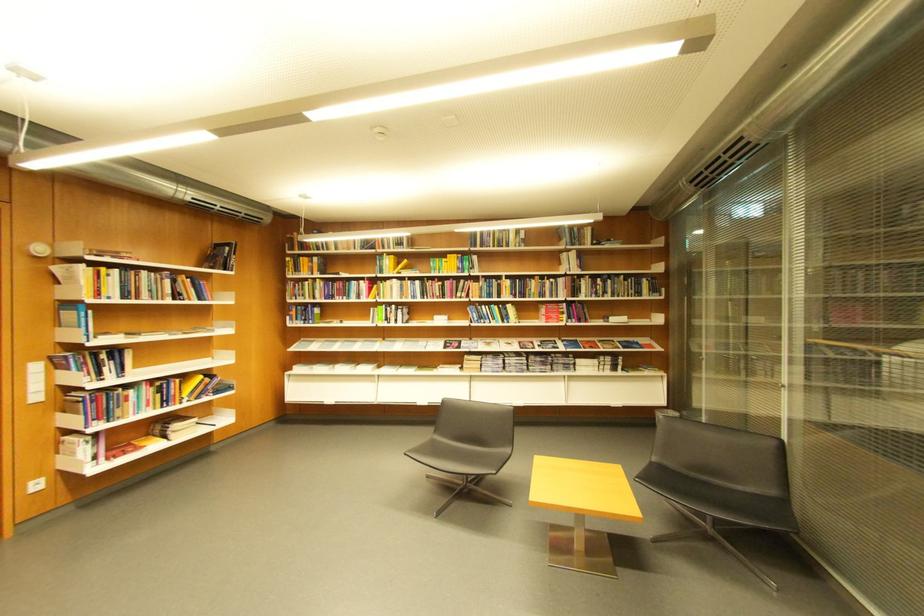
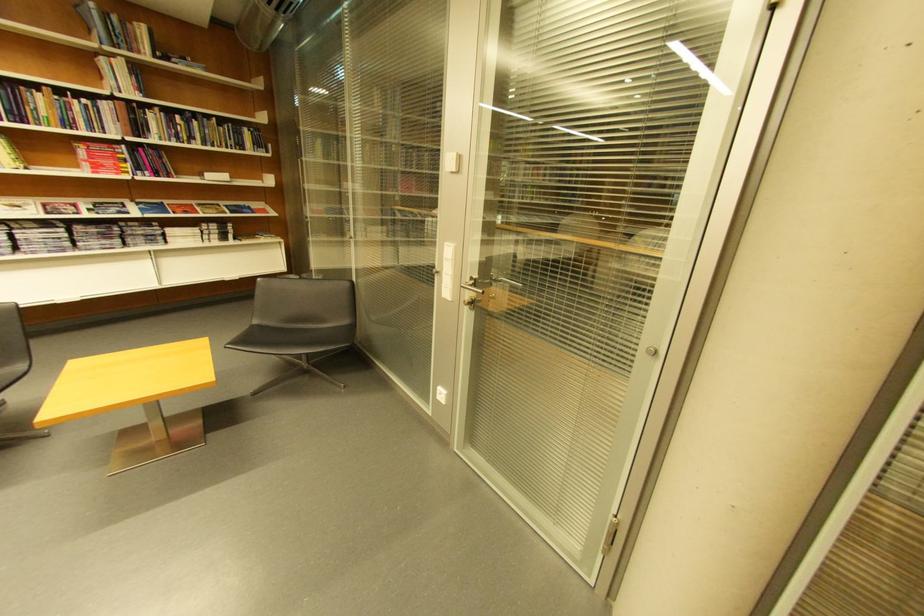
Where in the second image is the point corresponding to (x=663, y=466) from the first image?

(262, 329)